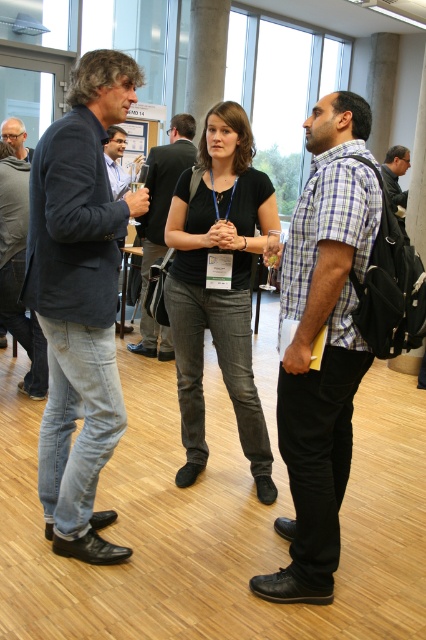
You are standing at the origin point of the coordinate system in this image. The black denim jeans at center is located at coordinate point [218,285]. If you want to move towards the black denim jeans at center, which direction should you move in terms of x and y coordinates?

To move towards the black denim jeans at center located at coordinate point [218,285] from the origin, you should move in the positive x and positive y direction since the coordinates are both greater than zero.

You are standing at the center of the room and want to walk to the denim jeans at left. Which direction should you go?

You should go to the left to reach the denim jeans at left.

You are organizing a photo shoot and need to ensure that the matte black jacket at center and the matte black glasses at upper left are both visible in the frame. Given their sizes, which object should you prioritize positioning closer to the camera to ensure visibility?

The matte black jacket at center should be positioned closer to the camera because it occupies less space than the matte black glasses at upper left, making it smaller and thus requiring closer placement for visibility.